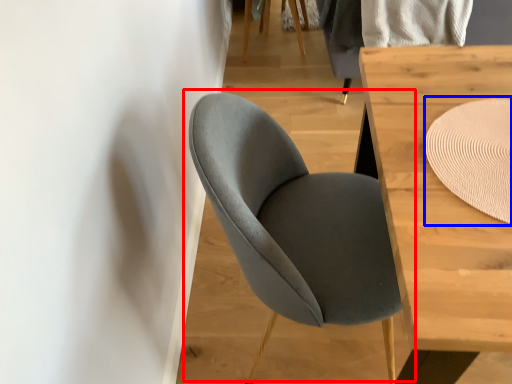
Question: Which point is closer to the camera, chair (highlighted by a red box) or mat (highlighted by a blue box)?

Choices:
 (A) chair
 (B) mat

Answer: (A)